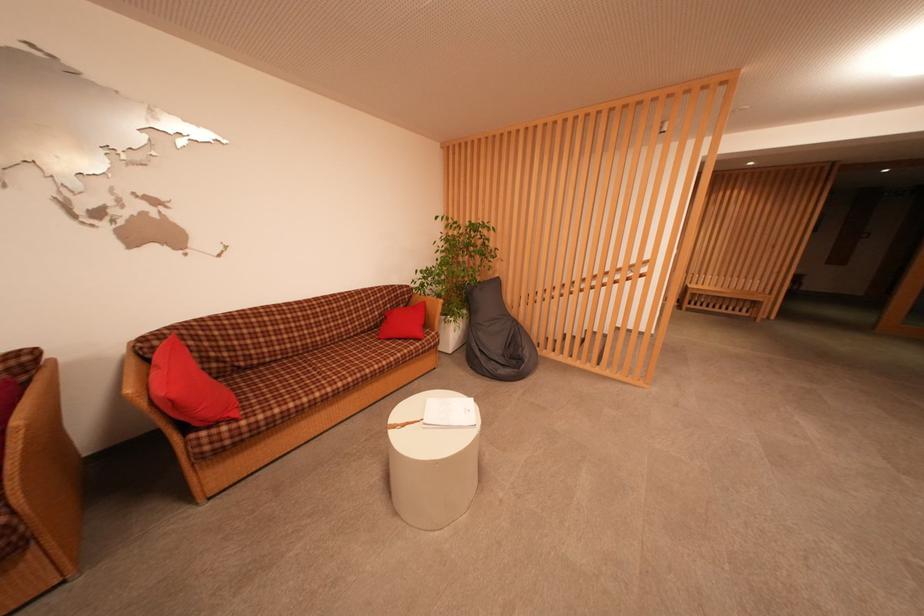
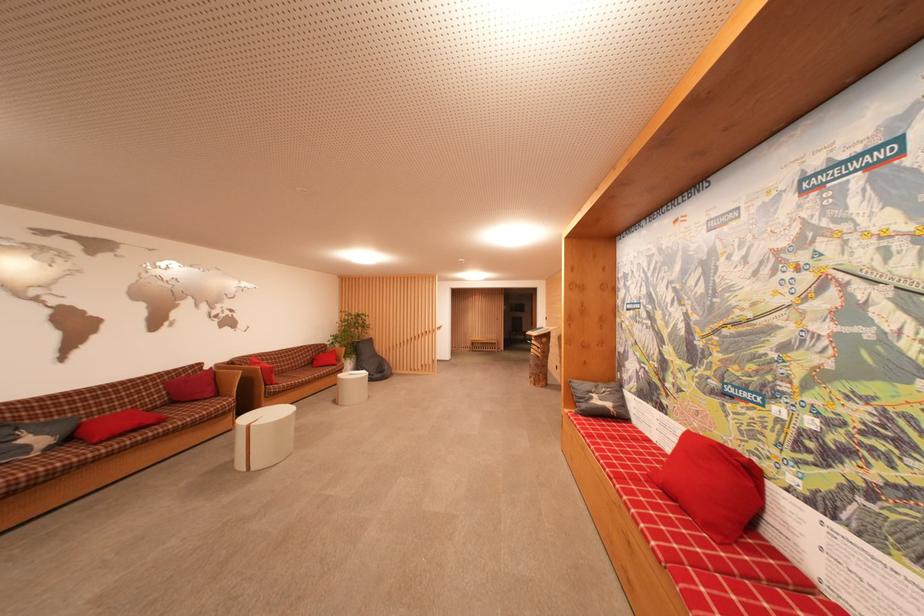
Locate, in the second image, the point that corresponds to point 428,306 in the first image.

(338, 354)